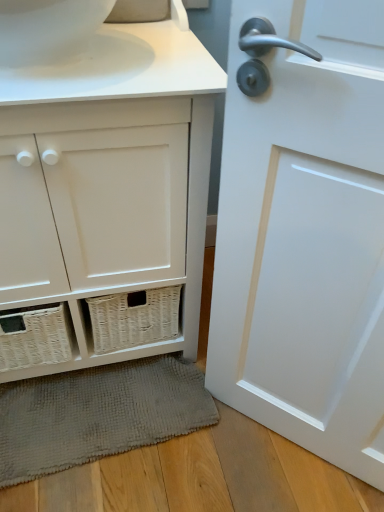
Question: Does white glossy toilet bowl at upper left come behind white wicker basket at lower left?

Choices:
 (A) no
 (B) yes

Answer: (B)

Question: Is white glossy toilet bowl at upper left facing away from white wicker basket at lower left?

Choices:
 (A) yes
 (B) no

Answer: (A)

Question: Considering the relative sizes of white glossy toilet bowl at upper left and white wicker basket at lower left in the image provided, is white glossy toilet bowl at upper left taller than white wicker basket at lower left?

Choices:
 (A) no
 (B) yes

Answer: (A)

Question: Can you confirm if white glossy toilet bowl at upper left is thinner than white wicker basket at lower left?

Choices:
 (A) yes
 (B) no

Answer: (A)

Question: Is white glossy toilet bowl at upper left bigger than white wicker basket at lower left?

Choices:
 (A) no
 (B) yes

Answer: (A)

Question: Is white glossy toilet bowl at upper left positioned in front of white wicker basket at lower left?

Choices:
 (A) yes
 (B) no

Answer: (B)

Question: Is white glossy door at right placed right next to gray textured bath mat at lower center?

Choices:
 (A) yes
 (B) no

Answer: (B)

Question: From a real-world perspective, is white glossy door at right on top of gray textured bath mat at lower center?

Choices:
 (A) yes
 (B) no

Answer: (A)

Question: From the image's perspective, is white glossy door at right below gray textured bath mat at lower center?

Choices:
 (A) no
 (B) yes

Answer: (A)

Question: Considering the relative sizes of white glossy door at right and gray textured bath mat at lower center in the image provided, is white glossy door at right wider than gray textured bath mat at lower center?

Choices:
 (A) no
 (B) yes

Answer: (A)

Question: Considering the relative positions of white glossy door at right and gray textured bath mat at lower center in the image provided, is white glossy door at right to the right of gray textured bath mat at lower center from the viewer's perspective?

Choices:
 (A) no
 (B) yes

Answer: (B)

Question: Is white glossy door at right taller than gray textured bath mat at lower center?

Choices:
 (A) no
 (B) yes

Answer: (B)

Question: From a real-world perspective, is white wicker basket at lower left on top of white glossy toilet bowl at upper left?

Choices:
 (A) no
 (B) yes

Answer: (A)